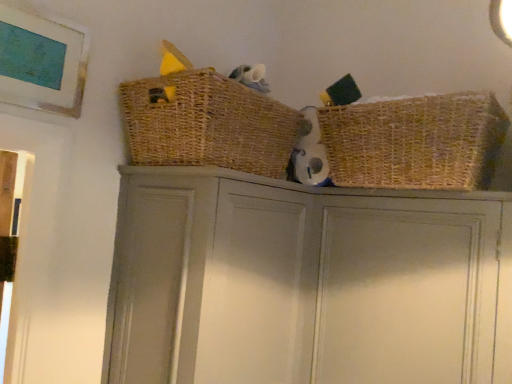
Question: Based on their positions, is woven brown basket at upper center, the 2th basket when ordered from right to left, located to the left or right of woven straw basket at upper right, acting as the 2th basket starting from the left?

Choices:
 (A) right
 (B) left

Answer: (B)

Question: From a real-world perspective, relative to woven straw basket at upper right, the first basket in the right-to-left sequence, is woven brown basket at upper center, marked as the 1th basket in a left-to-right arrangement, vertically above or below?

Choices:
 (A) below
 (B) above

Answer: (B)

Question: Based on their relative distances, which object is farther from the woven brown basket at upper center, the 2th basket when ordered from right to left?

Choices:
 (A) woven straw basket at upper right, acting as the 2th basket starting from the left
 (B) matte gray cabinet door at upper center
 (C) matte gray cupboard at center

Answer: (B)

Question: Estimate the real-world distances between objects in this image. Which object is farther from the woven brown basket at upper center, marked as the 1th basket in a left-to-right arrangement?

Choices:
 (A) matte gray cupboard at center
 (B) matte gray cabinet door at upper center
 (C) woven straw basket at upper right, acting as the 2th basket starting from the left

Answer: (B)